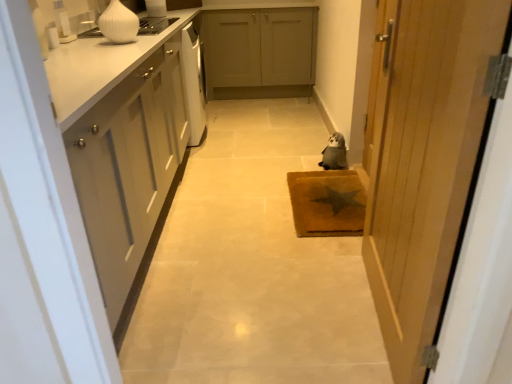
The width and height of the screenshot is (512, 384). Describe the element at coordinates (334, 153) in the screenshot. I see `fuzzy gray stuffed animal at center` at that location.

Describe the element at coordinates (259, 52) in the screenshot. I see `matte gray cabinets at center, marked as the 1th cabinetry in a back-to-front arrangement` at that location.

I want to click on wooden door at right, so click(424, 160).

Measure the distance between wooden door at right and camera.

The depth of wooden door at right is 72.23 centimeters.

What do you see at coordinates (327, 203) in the screenshot? This screenshot has width=512, height=384. I see `brown textured mat at center` at bounding box center [327, 203].

Locate an element on the screen. The image size is (512, 384). fuzzy gray stuffed animal at center is located at coordinates (334, 153).

What's the angular difference between white matte cabinet at left, the 2th cabinetry viewed from the back, and wooden door at right's facing directions?

white matte cabinet at left, the 2th cabinetry viewed from the back, and wooden door at right are facing 174 degrees away from each other.

Is white matte cabinet at left, acting as the 1th cabinetry starting from the left, beside wooden door at right?

No, white matte cabinet at left, acting as the 1th cabinetry starting from the left, is not beside wooden door at right.

Between white matte cabinet at left, the 1th cabinetry positioned from the front, and wooden door at right, which one has smaller size?

wooden door at right is smaller.

Would you say white matte cabinet at left, acting as the 1th cabinetry starting from the left, contains wooden door at right?

No, wooden door at right is not surrounded by white matte cabinet at left, acting as the 1th cabinetry starting from the left.

Between point (301, 77) and point (136, 28), which one is positioned in front?

Positioned in front is point (136, 28).

Between matte gray cabinets at center, which ranks as the second cabinetry in bottom-to-top order, and white glossy vase at upper left, which one has larger width?

matte gray cabinets at center, which ranks as the second cabinetry in bottom-to-top order, is wider.

Does matte gray cabinets at center, which ranks as the second cabinetry in bottom-to-top order, turn towards white glossy vase at upper left?

Yes, matte gray cabinets at center, which ranks as the second cabinetry in bottom-to-top order, is oriented towards white glossy vase at upper left.

How many degrees apart are the facing directions of matte gray cabinets at center, marked as the 1th cabinetry in a top-to-bottom arrangement, and white glossy vase at upper left?

They differ by 89.5 degrees in their facing directions.

Which is behind, point (329, 151) or point (214, 64)?

Positioned behind is point (214, 64).

Considering the positions of objects fuzzy gray stuffed animal at center and matte gray cabinets at center, which ranks as the second cabinetry in left-to-right order, in the image provided, who is more to the left, fuzzy gray stuffed animal at center or matte gray cabinets at center, which ranks as the second cabinetry in left-to-right order,?

matte gray cabinets at center, which ranks as the second cabinetry in left-to-right order.

Based on the photo, is fuzzy gray stuffed animal at center behind matte gray cabinets at center, marked as the 1th cabinetry in a top-to-bottom arrangement?

No, the depth of fuzzy gray stuffed animal at center is less than that of matte gray cabinets at center, marked as the 1th cabinetry in a top-to-bottom arrangement.

Considering the relative sizes of fuzzy gray stuffed animal at center and matte gray cabinets at center, placed as the 2th cabinetry when sorted from front to back, in the image provided, is fuzzy gray stuffed animal at center bigger than matte gray cabinets at center, placed as the 2th cabinetry when sorted from front to back,?

No.

How many degrees apart are the facing directions of fuzzy gray stuffed animal at center and wooden door at right?

The angle between the facing direction of fuzzy gray stuffed animal at center and the facing direction of wooden door at right is 24.7 degrees.

Considering the points (339, 166) and (399, 333), which point is behind, point (339, 166) or point (399, 333)?

The point (339, 166) is farther.

Is fuzzy gray stuffed animal at center in contact with wooden door at right?

fuzzy gray stuffed animal at center and wooden door at right are not in contact.

Based on the photo, from a real-world perspective, who is located lower, brown textured mat at center or fuzzy gray stuffed animal at center?

brown textured mat at center, from a real-world perspective.

Considering the sizes of objects brown textured mat at center and fuzzy gray stuffed animal at center in the image provided, who is smaller, brown textured mat at center or fuzzy gray stuffed animal at center?

fuzzy gray stuffed animal at center is smaller.

Is point (313, 227) behind point (336, 147)?

No, (313, 227) is closer to viewer.

From the image's perspective, would you say matte gray cabinets at center, marked as the 1th cabinetry in a top-to-bottom arrangement, is shown under brown textured mat at center?

Incorrect, from the image's perspective, matte gray cabinets at center, marked as the 1th cabinetry in a top-to-bottom arrangement, is higher than brown textured mat at center.

From a real-world perspective, between matte gray cabinets at center, positioned as the first cabinetry in right-to-left order, and brown textured mat at center, who is vertically higher?

In real-world perspective, matte gray cabinets at center, positioned as the first cabinetry in right-to-left order, is above.

Looking at the image, does white glossy vase at upper left seem bigger or smaller compared to white matte cabinet at left, the 2th cabinetry viewed from the back?

In the image, white glossy vase at upper left appears to be smaller than white matte cabinet at left, the 2th cabinetry viewed from the back.

Would you say white matte cabinet at left, the 1th cabinetry positioned from the front, is part of white glossy vase at upper left's contents?

No, white matte cabinet at left, the 1th cabinetry positioned from the front, is not inside white glossy vase at upper left.

Measure the distance from white glossy vase at upper left to white matte cabinet at left, the 2th cabinetry viewed from the back.

white glossy vase at upper left and white matte cabinet at left, the 2th cabinetry viewed from the back, are 28.03 inches apart from each other.

From the image's perspective, is white glossy vase at upper left located above white matte cabinet at left, the 2th cabinetry when ordered from right to left?

Yes, from the image's perspective, white glossy vase at upper left is above white matte cabinet at left, the 2th cabinetry when ordered from right to left.

Locate an element on the screen. Image resolution: width=512 pixels, height=384 pixels. door that is below the white matte cabinet at left, acting as the 1th cabinetry starting from the left (from the image's perspective) is located at coordinates (424, 160).

You are a GUI agent. You are given a task and a screenshot of the screen. Output one action in this format:
    pyautogui.click(x=<x>, y=<y>)
    Task: Click on the vase above the matte gray cabinets at center, which ranks as the second cabinetry in bottom-to-top order (from a real-world perspective)
    Image resolution: width=512 pixels, height=384 pixels.
    Given the screenshot: What is the action you would take?
    pyautogui.click(x=119, y=23)

Based on their spatial positions, is white glossy vase at upper left or fuzzy gray stuffed animal at center further from matte gray cabinets at center, marked as the 1th cabinetry in a top-to-bottom arrangement?

white glossy vase at upper left lies further to matte gray cabinets at center, marked as the 1th cabinetry in a top-to-bottom arrangement, than the other object.

Based on their spatial positions, is wooden door at right or white matte cabinet at left, the 1th cabinetry positioned from the front, closer to white glossy vase at upper left?

white matte cabinet at left, the 1th cabinetry positioned from the front.

Based on their spatial positions, is wooden door at right or brown textured mat at center closer to matte gray cabinets at center, which ranks as the second cabinetry in left-to-right order?

brown textured mat at center is closer to matte gray cabinets at center, which ranks as the second cabinetry in left-to-right order.

Consider the image. From the image, which object appears to be nearer to matte gray cabinets at center, which ranks as the second cabinetry in left-to-right order, brown textured mat at center or wooden door at right?

Among the two, brown textured mat at center is located nearer to matte gray cabinets at center, which ranks as the second cabinetry in left-to-right order.

Estimate the real-world distances between objects in this image. Which object is closer to brown textured mat at center, white glossy vase at upper left or fuzzy gray stuffed animal at center?

fuzzy gray stuffed animal at center is closer to brown textured mat at center.

From the picture: Estimate the real-world distances between objects in this image. Which object is further from white glossy vase at upper left, white matte cabinet at left, the 1th cabinetry positioned from the front, or matte gray cabinets at center, marked as the 1th cabinetry in a top-to-bottom arrangement?

matte gray cabinets at center, marked as the 1th cabinetry in a top-to-bottom arrangement, lies further to white glossy vase at upper left than the other object.

Estimate the real-world distances between objects in this image. Which object is closer to wooden door at right, white matte cabinet at left, the 2th cabinetry viewed from the back, or fuzzy gray stuffed animal at center?

white matte cabinet at left, the 2th cabinetry viewed from the back, is positioned closer to the anchor wooden door at right.

When comparing their distances from brown textured mat at center, does fuzzy gray stuffed animal at center or white matte cabinet at left, the 1th cabinetry positioned from the front, seem closer?

Among the two, fuzzy gray stuffed animal at center is located nearer to brown textured mat at center.

At what (x,y) coordinates should I click in order to perform the action: click on animal located between brown textured mat at center and matte gray cabinets at center, marked as the 1th cabinetry in a top-to-bottom arrangement, in the depth direction. Please return your answer as a coordinate pair (x, y). Looking at the image, I should click on (334, 153).

Image resolution: width=512 pixels, height=384 pixels. I want to click on doormat positioned between wooden door at right and matte gray cabinets at center, marked as the 1th cabinetry in a top-to-bottom arrangement, from near to far, so click(x=327, y=203).

This screenshot has width=512, height=384. In order to click on animal positioned between white glossy vase at upper left and matte gray cabinets at center, marked as the 1th cabinetry in a top-to-bottom arrangement, from near to far in this screenshot , I will do `click(334, 153)`.

Find the location of a particular element. doormat between white matte cabinet at left, the 2th cabinetry when ordered from right to left, and matte gray cabinets at center, which ranks as the second cabinetry in left-to-right order, in the front-back direction is located at coordinates (327, 203).